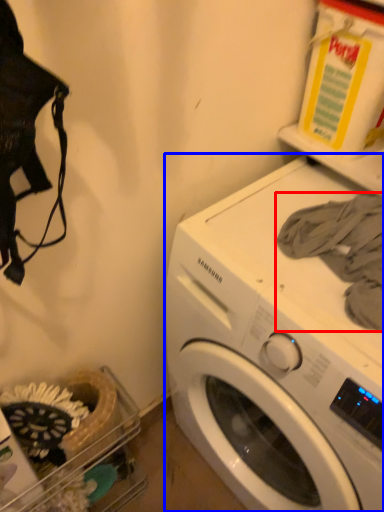
Question: Among these objects, which one is nearest to the camera, clothing (highlighted by a red box) or washing machine (highlighted by a blue box)?

Choices:
 (A) clothing
 (B) washing machine

Answer: (B)